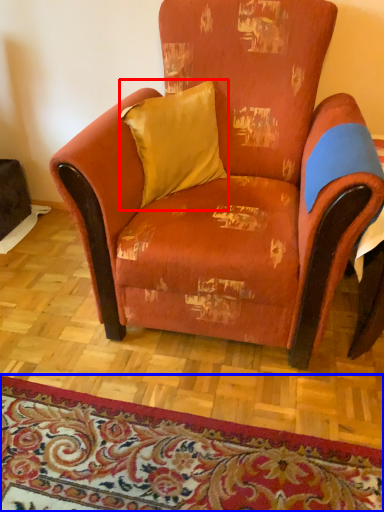
Question: Which of the following is the farthest to the observer, pillow (highlighted by a red box) or mat (highlighted by a blue box)?

Choices:
 (A) pillow
 (B) mat

Answer: (A)